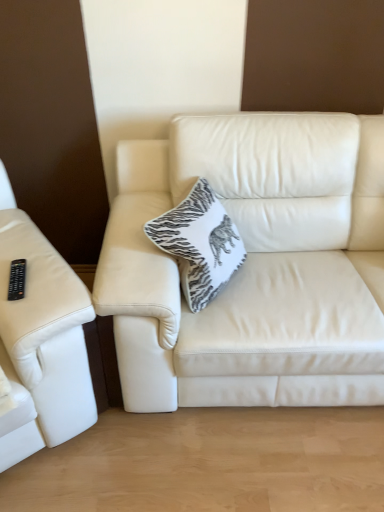
I want to click on leather couch at left, which is the second studio couch from right to left, so click(41, 341).

The width and height of the screenshot is (384, 512). I want to click on black plastic remote at left, so click(x=17, y=279).

Where is `white leather couch at center, the 1th studio couch from the right`? The height and width of the screenshot is (512, 384). white leather couch at center, the 1th studio couch from the right is located at coordinates (254, 265).

I want to click on leather couch at left, arranged as the first studio couch when viewed from the left, so (41, 341).

Choose the correct answer: Is black plastic remote at left inside white leather couch at center, the second studio couch when ordered from left to right, or outside it?

The correct answer is: outside.

Locate an element on the screen. This screenshot has width=384, height=512. studio couch above the black plastic remote at left (from the image's perspective) is located at coordinates (254, 265).

Is black plastic remote at left placed right next to white leather couch at center, the second studio couch when ordered from left to right?

No, black plastic remote at left is not touching white leather couch at center, the second studio couch when ordered from left to right.

From the picture: Is black plastic remote at left turned away from white leather couch at center, the 1th studio couch from the right?

black plastic remote at left does not have its back to white leather couch at center, the 1th studio couch from the right.

How distant is leather couch at left, arranged as the first studio couch when viewed from the left, from white leather couch at center, the second studio couch when ordered from left to right?

leather couch at left, arranged as the first studio couch when viewed from the left, and white leather couch at center, the second studio couch when ordered from left to right, are 19.57 inches apart from each other.

Which point is more distant from viewer, (6, 207) or (173, 324)?

The point (6, 207) is farther from the camera.

Is leather couch at left, which is the second studio couch from right to left, not near white leather couch at center, the second studio couch when ordered from left to right?

No.

In the image, is leather couch at left, arranged as the first studio couch when viewed from the left, positioned in front of or behind white leather couch at center, the 1th studio couch from the right?

leather couch at left, arranged as the first studio couch when viewed from the left, is positioned closer to the viewer than white leather couch at center, the 1th studio couch from the right.

Does black plastic remote at left have a greater height compared to leather couch at left, which is the second studio couch from right to left?

No, black plastic remote at left is not taller than leather couch at left, which is the second studio couch from right to left.

Which is more to the right, black plastic remote at left or leather couch at left, arranged as the first studio couch when viewed from the left?

black plastic remote at left.

Is leather couch at left, arranged as the first studio couch when viewed from the left, at the back of black plastic remote at left?

Yes, black plastic remote at left's orientation is away from leather couch at left, arranged as the first studio couch when viewed from the left.

From the image's perspective, who appears lower, black plastic remote at left or leather couch at left, which is the second studio couch from right to left?

leather couch at left, which is the second studio couch from right to left, is shown below in the image.

Considering the relative positions of white textured cushion at center and leather couch at left, arranged as the first studio couch when viewed from the left, in the image provided, is white textured cushion at center to the left or to the right of leather couch at left, arranged as the first studio couch when viewed from the left,?

Based on their positions, white textured cushion at center is located to the right of leather couch at left, arranged as the first studio couch when viewed from the left.

Which of these two, white textured cushion at center or leather couch at left, which is the second studio couch from right to left, is thinner?

white textured cushion at center.

Which is correct: white textured cushion at center is inside leather couch at left, arranged as the first studio couch when viewed from the left, or outside of it?

white textured cushion at center is outside leather couch at left, arranged as the first studio couch when viewed from the left.

Between white textured cushion at center and leather couch at left, arranged as the first studio couch when viewed from the left, which one has smaller size?

white textured cushion at center is smaller.

Based on the photo, how much distance is there between white leather couch at center, the 1th studio couch from the right, and white textured cushion at center?

white leather couch at center, the 1th studio couch from the right, is 8.84 inches from white textured cushion at center.

Between white leather couch at center, the 1th studio couch from the right, and white textured cushion at center, which one is positioned behind?

white textured cushion at center is behind.

From the image's perspective, which object appears higher, white leather couch at center, the second studio couch when ordered from left to right, or white textured cushion at center?

white textured cushion at center is shown above in the image.

Is point (282, 127) positioned before point (18, 281)?

No, it is behind (18, 281).

Does white leather couch at center, the second studio couch when ordered from left to right, have a larger size compared to black plastic remote at left?

Yes, white leather couch at center, the second studio couch when ordered from left to right, is bigger than black plastic remote at left.

Is white leather couch at center, the 1th studio couch from the right, shorter than black plastic remote at left?

In fact, white leather couch at center, the 1th studio couch from the right, may be taller than black plastic remote at left.

Would you say black plastic remote at left is part of white leather couch at center, the 1th studio couch from the right,'s contents?

No, black plastic remote at left is not inside white leather couch at center, the 1th studio couch from the right.

Is point (183, 268) in front of point (9, 293)?

No, (183, 268) is behind (9, 293).

From the picture: From a real-world perspective, is white textured cushion at center on black plastic remote at left?

No, from a real-world perspective, white textured cushion at center is not on top of black plastic remote at left.

From the image's perspective, which one is positioned lower, white textured cushion at center or black plastic remote at left?

black plastic remote at left appears lower in the image.

Considering the relative sizes of white textured cushion at center and black plastic remote at left in the image provided, is white textured cushion at center shorter than black plastic remote at left?

In fact, white textured cushion at center may be taller than black plastic remote at left.

Identify the location of studio couch on the right of black plastic remote at left. (254, 265).

Where is `studio couch that appears behind the leather couch at left, arranged as the first studio couch when viewed from the left`? studio couch that appears behind the leather couch at left, arranged as the first studio couch when viewed from the left is located at coordinates (254, 265).

Consider the image. Based on their spatial positions, is black plastic remote at left or leather couch at left, arranged as the first studio couch when viewed from the left, further from white textured cushion at center?

The object further to white textured cushion at center is black plastic remote at left.

In the scene shown: Looking at the image, which one is located further to white textured cushion at center, leather couch at left, arranged as the first studio couch when viewed from the left, or black plastic remote at left?

black plastic remote at left is further to white textured cushion at center.

Estimate the real-world distances between objects in this image. Which object is closer to white leather couch at center, the second studio couch when ordered from left to right, black plastic remote at left or leather couch at left, which is the second studio couch from right to left?

Based on the image, leather couch at left, which is the second studio couch from right to left, appears to be nearer to white leather couch at center, the second studio couch when ordered from left to right.

Looking at the image, which one is located further to leather couch at left, arranged as the first studio couch when viewed from the left, black plastic remote at left or white textured cushion at center?

Among the two, white textured cushion at center is located further to leather couch at left, arranged as the first studio couch when viewed from the left.

Considering their positions, is leather couch at left, arranged as the first studio couch when viewed from the left, positioned closer to black plastic remote at left than white leather couch at center, the 1th studio couch from the right?

leather couch at left, arranged as the first studio couch when viewed from the left, is closer to black plastic remote at left.

Considering their positions, is white leather couch at center, the 1th studio couch from the right, positioned further to black plastic remote at left than white textured cushion at center?

Based on the image, white leather couch at center, the 1th studio couch from the right, appears to be further to black plastic remote at left.

Based on their spatial positions, is leather couch at left, arranged as the first studio couch when viewed from the left, or white textured cushion at center further from black plastic remote at left?

white textured cushion at center lies further to black plastic remote at left than the other object.

Based on their spatial positions, is white textured cushion at center or leather couch at left, which is the second studio couch from right to left, further from black plastic remote at left?

white textured cushion at center.

I want to click on remote between leather couch at left, arranged as the first studio couch when viewed from the left, and white leather couch at center, the 1th studio couch from the right, from left to right, so click(x=17, y=279).

At what (x,y) coordinates should I click in order to perform the action: click on throw pillow situated between black plastic remote at left and white leather couch at center, the 1th studio couch from the right, from left to right. Please return your answer as a coordinate pair (x, y). The image size is (384, 512). Looking at the image, I should click on (199, 243).

The image size is (384, 512). I want to click on remote located between leather couch at left, which is the second studio couch from right to left, and white textured cushion at center in the left-right direction, so click(x=17, y=279).

At what (x,y) coordinates should I click in order to perform the action: click on throw pillow situated between leather couch at left, which is the second studio couch from right to left, and white leather couch at center, the 1th studio couch from the right, from left to right. Please return your answer as a coordinate pair (x, y). Looking at the image, I should click on (199, 243).